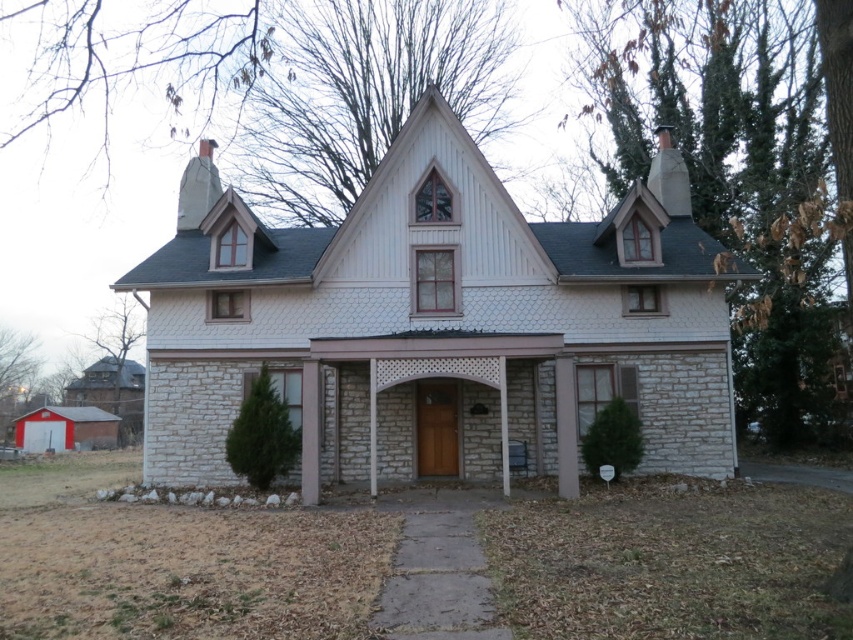
You are standing at the entrance of the two story house and want to place a new decorative statue exactly at the center of the house. Given the location of the white stone pillar at right, can you determine if the pillar is positioned to the left or right of the house center?

The white stone pillar at right is located at point (566, 428). Since the house center would be at point (426, 320), the pillar is positioned to the right of the center.